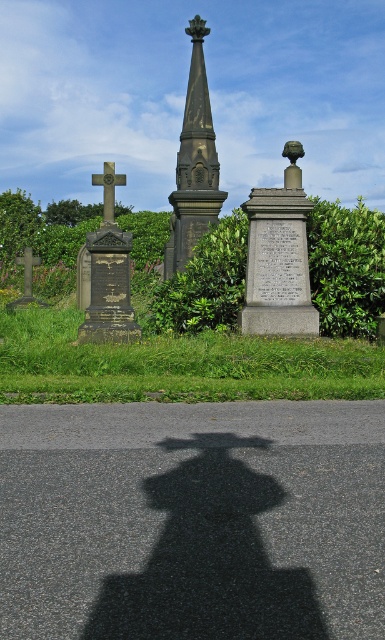
Question: Which point is farther from the camera taking this photo?

Choices:
 (A) (301, 246)
 (B) (192, 88)
 (C) (51, 280)
 (D) (127, 234)

Answer: (C)

Question: Does gray stone monument at center have a lesser width compared to dark gray stone spire at center?

Choices:
 (A) no
 (B) yes

Answer: (B)

Question: Which point is farther to the camera?

Choices:
 (A) (45, 248)
 (B) (137, 332)

Answer: (A)

Question: Is green leafy hedge at center wider than dark gray stone cross at left?

Choices:
 (A) yes
 (B) no

Answer: (A)

Question: Which object is the farthest from the gray stone monument at center?

Choices:
 (A) dark gray stone spire at center
 (B) dark gray stone cross at left
 (C) green leafy hedge at center

Answer: (A)

Question: Is green leafy hedge at center below gray stone monument at center?

Choices:
 (A) yes
 (B) no

Answer: (B)